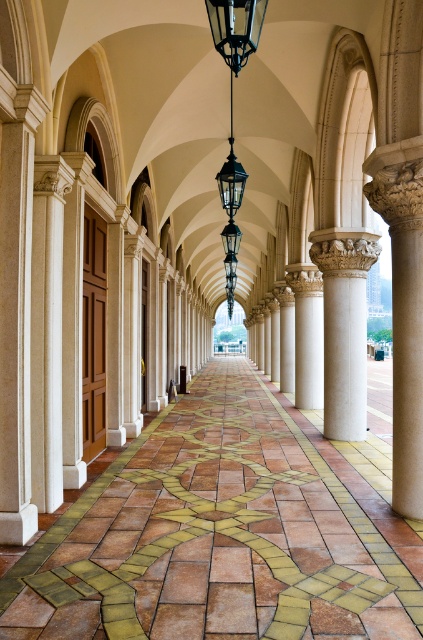
Is point (249, 588) positioned behind point (395, 504)?

No, it is not.

Between brown tile floor at center and white stone column at center, which one is positioned lower?

Positioned lower is brown tile floor at center.

Does point (280, 522) come behind point (398, 497)?

That is False.

You are a GUI agent. You are given a task and a screenshot of the screen. Output one action in this format:
    pyautogui.click(x=<x>, y=<y>)
    Task: Click on the brown tile floor at center
    The width and height of the screenshot is (423, 640).
    Given the screenshot: What is the action you would take?
    pyautogui.click(x=222, y=531)

Who is lower down, brown tile floor at center or white marble column at center?

brown tile floor at center is below.

Can you confirm if brown tile floor at center is shorter than white marble column at center?

Yes, brown tile floor at center is shorter than white marble column at center.

Is point (162, 552) more distant than point (332, 236)?

No.

Identify the location of brown tile floor at center. This screenshot has height=640, width=423. (222, 531).

Measure the distance between white stone column at center and camera.

The distance of white stone column at center from camera is 20.67 feet.

Between white stone column at center and black metal lantern at upper center, which one is positioned lower?

white stone column at center is below.

Does point (406, 264) lie behind point (227, 49)?

No, it is not.

Identify the location of white stone column at center. Image resolution: width=423 pixels, height=640 pixels. (403, 307).